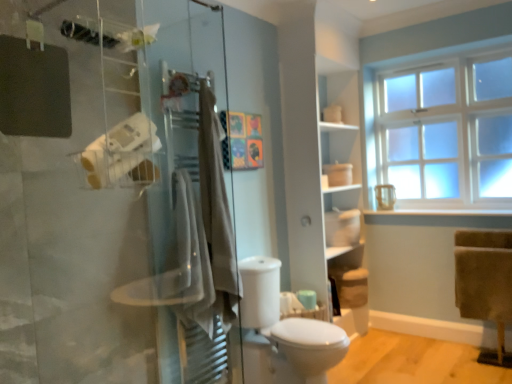
Question: Is beige cotton bath towel at center, which ranks as the second bath towel in back-to-front order, at the right side of beige cotton towel at center, the first bath towel positioned from the back?

Choices:
 (A) no
 (B) yes

Answer: (A)

Question: From the image's perspective, does beige cotton bath towel at center, which ranks as the second bath towel in back-to-front order, appear higher than beige cotton towel at center, the first bath towel positioned from the back?

Choices:
 (A) yes
 (B) no

Answer: (B)

Question: Are beige cotton bath towel at center, which ranks as the second bath towel in back-to-front order, and beige cotton towel at center, the first bath towel positioned from the back, beside each other?

Choices:
 (A) yes
 (B) no

Answer: (B)

Question: Is beige cotton bath towel at center, which ranks as the second bath towel in back-to-front order, wider than beige cotton towel at center, which ranks as the second bath towel in front-to-back order?

Choices:
 (A) yes
 (B) no

Answer: (A)

Question: Is beige cotton bath towel at center, the 1th bath towel when ordered from front to back, further to the viewer compared to beige cotton towel at center, which ranks as the second bath towel in front-to-back order?

Choices:
 (A) yes
 (B) no

Answer: (B)

Question: From the image's perspective, is beige cotton bath towel at center, which ranks as the second bath towel in back-to-front order, located beneath beige cotton towel at center, which ranks as the second bath towel in front-to-back order?

Choices:
 (A) yes
 (B) no

Answer: (A)

Question: Is beige cotton towel at center, the first bath towel positioned from the back, turned away from white matte toilet paper at left?

Choices:
 (A) no
 (B) yes

Answer: (A)

Question: Can you confirm if beige cotton towel at center, which ranks as the second bath towel in front-to-back order, is smaller than white matte toilet paper at left?

Choices:
 (A) yes
 (B) no

Answer: (B)

Question: Can you confirm if beige cotton towel at center, the first bath towel positioned from the back, is shorter than white matte toilet paper at left?

Choices:
 (A) no
 (B) yes

Answer: (A)

Question: Can you confirm if beige cotton towel at center, which ranks as the second bath towel in front-to-back order, is thinner than white matte toilet paper at left?

Choices:
 (A) yes
 (B) no

Answer: (B)

Question: Considering the relative positions of beige cotton towel at center, which ranks as the second bath towel in front-to-back order, and white matte toilet paper at left in the image provided, is beige cotton towel at center, which ranks as the second bath towel in front-to-back order, to the left of white matte toilet paper at left from the viewer's perspective?

Choices:
 (A) no
 (B) yes

Answer: (A)

Question: Does beige cotton towel at center, the first bath towel positioned from the back, lie behind white matte toilet paper at left?

Choices:
 (A) no
 (B) yes

Answer: (B)

Question: Is beige cotton bath towel at center, the 1th bath towel when ordered from front to back, positioned beyond the bounds of white matte shelf at center?

Choices:
 (A) yes
 (B) no

Answer: (A)